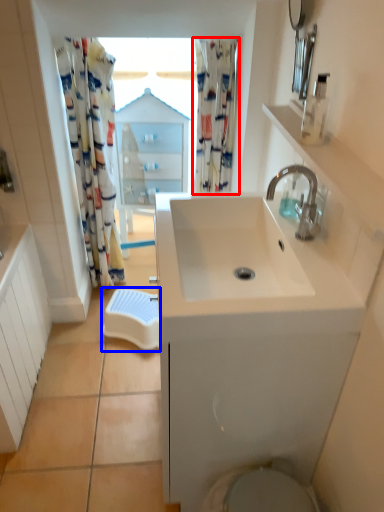
Question: Which of the following is the farthest to the observer, shower curtain (highlighted by a red box) or beach towel (highlighted by a blue box)?

Choices:
 (A) shower curtain
 (B) beach towel

Answer: (B)